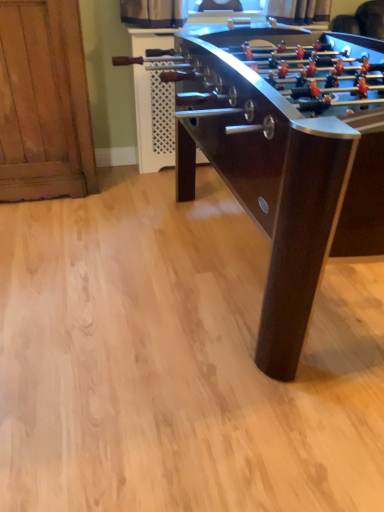
Locate an element on the screen. The image size is (384, 512). vacant space that is in between wooden cabinet at left and dark brown wood foosball table at center is located at coordinates (87, 234).